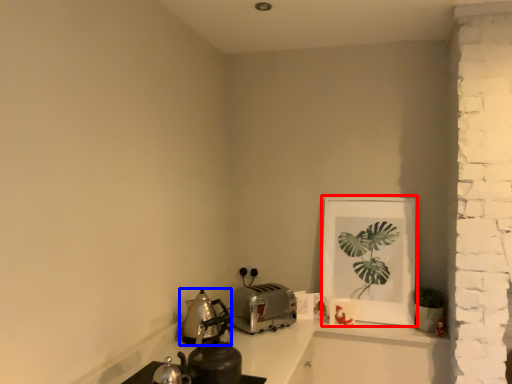
Question: Which point is closer to the camera, picture frame (highlighted by a red box) or kitchen appliance (highlighted by a blue box)?

Choices:
 (A) picture frame
 (B) kitchen appliance

Answer: (B)